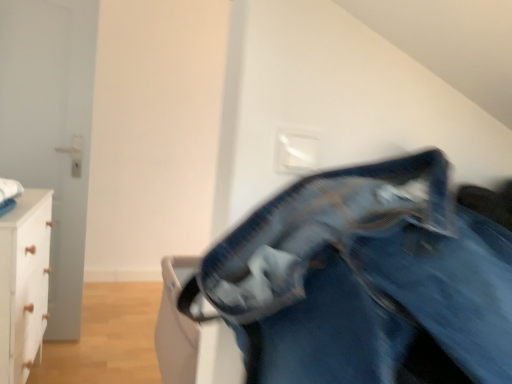
Identify the location of denim pants at center. (364, 279).

Describe the element at coordinates (364, 279) in the screenshot. The height and width of the screenshot is (384, 512). I see `denim pants at center` at that location.

In order to face denim pants at center, should I rotate leftwards or rightwards?

Rotate right and turn 23.858 degrees.

You are a GUI agent. You are given a task and a screenshot of the screen. Output one action in this format:
    pyautogui.click(x=<x>, y=<y>)
    Task: Click on the white matte chest of drawers at left
    
    Given the screenshot: What is the action you would take?
    pyautogui.click(x=24, y=282)

Measure the distance between point (29, 353) and camera.

Point (29, 353) and camera are 1.74 meters apart from each other.

Describe the element at coordinates (24, 282) in the screenshot. The image size is (512, 384). I see `white matte chest of drawers at left` at that location.

This screenshot has height=384, width=512. Identify the location of denim pants at center. (364, 279).

Considering the positions of objects denim pants at center and white matte chest of drawers at left in the image provided, who is more to the right, denim pants at center or white matte chest of drawers at left?

denim pants at center is more to the right.

Considering their positions, is denim pants at center located in front of or behind white matte chest of drawers at left?

Visually, denim pants at center is located in front of white matte chest of drawers at left.

Between point (410, 326) and point (13, 324), which one is positioned in front?

The point (410, 326) is more forward.

From the image's perspective, would you say denim pants at center is positioned over white matte chest of drawers at left?

Yes, from the image's perspective, denim pants at center is above white matte chest of drawers at left.

From a real-world perspective, who is located lower, denim pants at center or white matte chest of drawers at left?

In real-world perspective, white matte chest of drawers at left is lower.

Does denim pants at center have a greater width compared to white matte chest of drawers at left?

Correct, the width of denim pants at center exceeds that of white matte chest of drawers at left.

Considering the relative sizes of denim pants at center and white matte chest of drawers at left in the image provided, is denim pants at center shorter than white matte chest of drawers at left?

Yes, denim pants at center is shorter than white matte chest of drawers at left.

Is denim pants at center smaller than white matte chest of drawers at left?

Indeed, denim pants at center has a smaller size compared to white matte chest of drawers at left.

Would you say denim pants at center is inside or outside white matte chest of drawers at left?

denim pants at center is not inside white matte chest of drawers at left, it's outside.

Is denim pants at center next to white matte chest of drawers at left?

No.

Is denim pants at center oriented towards white matte chest of drawers at left?

No, denim pants at center is not turned towards white matte chest of drawers at left.

How many degrees apart are the facing directions of denim pants at center and white matte chest of drawers at left?

The angle between the facing direction of denim pants at center and the facing direction of white matte chest of drawers at left is 89.7 degrees.

From the picture: How distant is denim pants at center from white matte chest of drawers at left?

They are 1.27 meters apart.

Where is `trousers located above the white matte chest of drawers at left (from a real-world perspective)`? The image size is (512, 384). trousers located above the white matte chest of drawers at left (from a real-world perspective) is located at coordinates click(x=364, y=279).

Would you say white matte chest of drawers at left is to the left or to the right of denim pants at center in the picture?

Based on their positions, white matte chest of drawers at left is located to the left of denim pants at center.

Which object is further away from the camera taking this photo, white matte chest of drawers at left or denim pants at center?

white matte chest of drawers at left.

In the scene shown: Which is closer to the camera, (x=21, y=247) or (x=422, y=307)?

The point (x=422, y=307) is closer to the camera.

Consider the image. From the image's perspective, is white matte chest of drawers at left on denim pants at center?

No.

From a real-world perspective, which is physically below, white matte chest of drawers at left or denim pants at center?

From a 3D spatial view, white matte chest of drawers at left is below.

Looking at their sizes, would you say white matte chest of drawers at left is wider or thinner than denim pants at center?

Considering their sizes, white matte chest of drawers at left looks slimmer than denim pants at center.

Which of these two, white matte chest of drawers at left or denim pants at center, stands shorter?

denim pants at center is shorter.

Between white matte chest of drawers at left and denim pants at center, which one has larger size?

Bigger between the two is white matte chest of drawers at left.

Would you say white matte chest of drawers at left contains denim pants at center?

No, denim pants at center is located outside of white matte chest of drawers at left.

Is there a large distance between white matte chest of drawers at left and denim pants at center?

That's right, there is a large distance between white matte chest of drawers at left and denim pants at center.

Looking at this image, is white matte chest of drawers at left aimed at denim pants at center?

No, white matte chest of drawers at left is not aimed at denim pants at center.

How many degrees apart are the facing directions of white matte chest of drawers at left and denim pants at center?

white matte chest of drawers at left and denim pants at center are facing 89.7 degrees away from each other.

Where is `trousers located in front of the white matte chest of drawers at left`? The width and height of the screenshot is (512, 384). trousers located in front of the white matte chest of drawers at left is located at coordinates (364, 279).

This screenshot has width=512, height=384. Identify the location of trousers lying above the white matte chest of drawers at left (from the image's perspective). (364, 279).

The height and width of the screenshot is (384, 512). In order to click on the chest of drawers beneath the denim pants at center (from a real-world perspective) in this screenshot , I will do `click(24, 282)`.